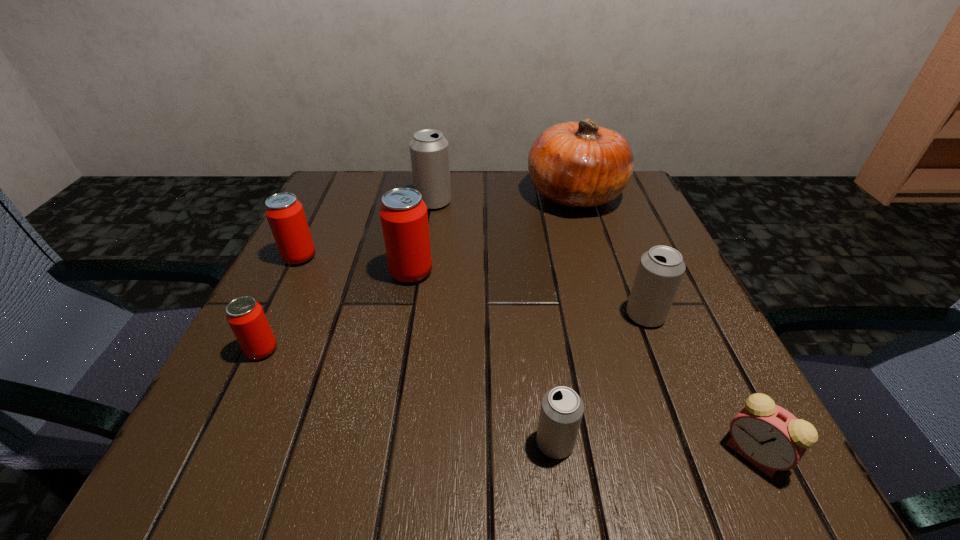
Identify the location of the nearest white beer can. This screenshot has width=960, height=540. (561, 412).

The width and height of the screenshot is (960, 540). I want to click on pink alarm clock, so click(x=771, y=438).

The width and height of the screenshot is (960, 540). What are the coordinates of `free location located on the left of the orange pumpkin` in the screenshot? It's located at (480, 195).

What are the coordinates of `free space located 0.310m on the front of the leftmost white beer can` in the screenshot? It's located at pos(418,308).

The height and width of the screenshot is (540, 960). I want to click on vacant region located 0.220m on the front of the rightmost red beer can, so click(391, 387).

At what (x,y) coordinates should I click in order to perform the action: click on free location located 0.240m on the back of the second smallest white beer can. Please return your answer as a coordinate pair (x, y). Image resolution: width=960 pixels, height=540 pixels. Looking at the image, I should click on (611, 225).

Locate an element on the screen. vacant area situated 0.060m on the back of the second biggest red beer can is located at coordinates (313, 231).

At what (x,y) coordinates should I click in order to perform the action: click on vacant area situated on the right of the smallest red beer can. Please return your answer as a coordinate pair (x, y). This screenshot has width=960, height=540. Looking at the image, I should click on (397, 350).

You are a GUI agent. You are given a task and a screenshot of the screen. Output one action in this format:
    pyautogui.click(x=<x>, y=<y>)
    Task: Click on the vacant area situated on the right of the second white beer can from left to right
    The image size is (960, 540).
    Given the screenshot: What is the action you would take?
    pyautogui.click(x=695, y=443)

I want to click on free space located on the face of the pink alarm clock, so click(x=640, y=454).